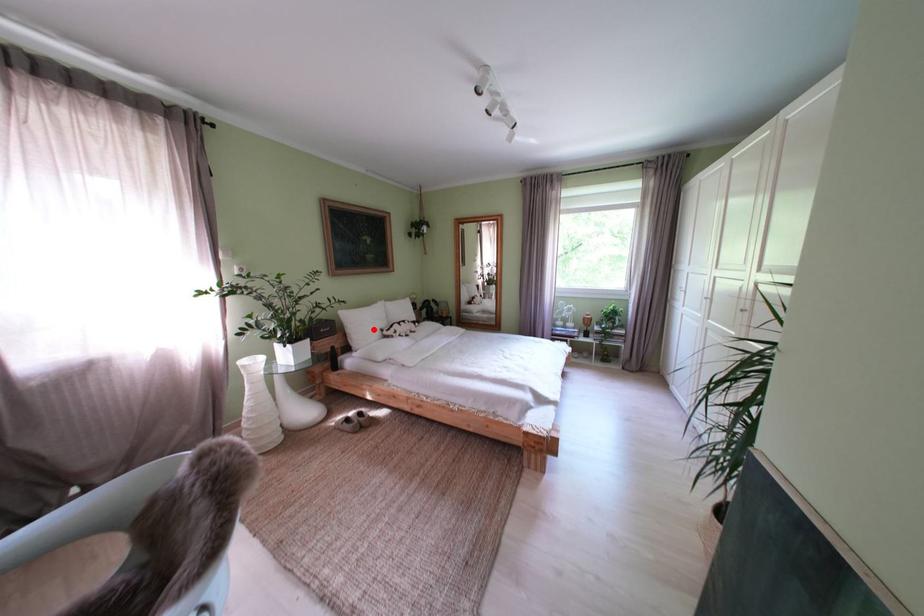
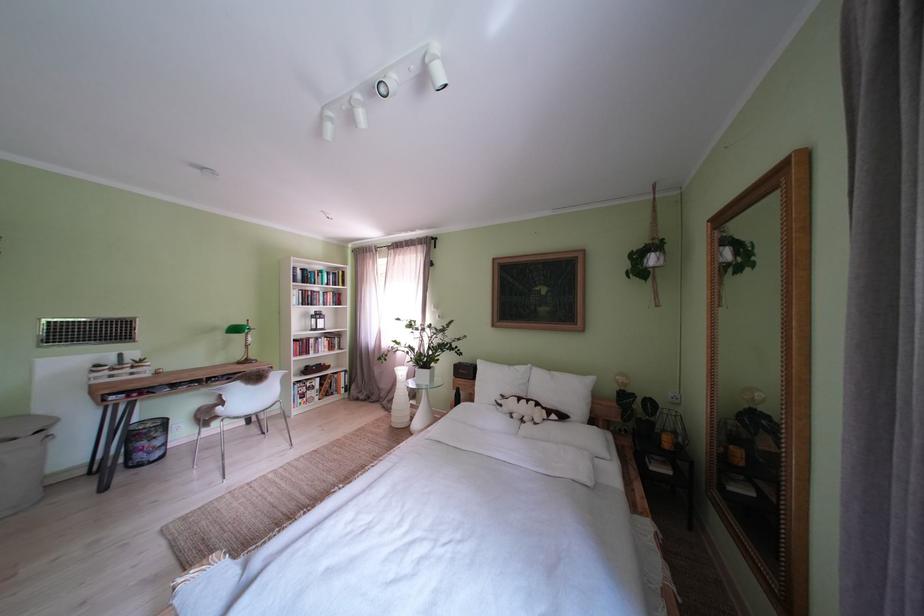
Locate, in the second image, the point that corresponds to the highlighted location in the first image.

(500, 386)